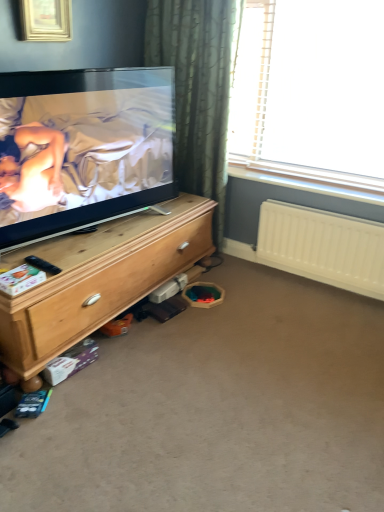
Question: From a real-world perspective, is white plastic radiator at lower right located beneath carpet at lower center?

Choices:
 (A) no
 (B) yes

Answer: (A)

Question: Can you confirm if white plastic radiator at lower right is positioned to the left of carpet at lower center?

Choices:
 (A) no
 (B) yes

Answer: (A)

Question: Is carpet at lower center a part of white plastic radiator at lower right?

Choices:
 (A) no
 (B) yes

Answer: (A)

Question: Is white plastic radiator at lower right not inside carpet at lower center?

Choices:
 (A) no
 (B) yes

Answer: (B)

Question: Is white plastic radiator at lower right wider than carpet at lower center?

Choices:
 (A) no
 (B) yes

Answer: (A)

Question: Visually, is carpet at lower center positioned to the left or to the right of gold metallic picture frame at upper left?

Choices:
 (A) right
 (B) left

Answer: (A)

Question: Considering the positions of point (269, 463) and point (36, 7), is point (269, 463) closer or farther from the camera than point (36, 7)?

Choices:
 (A) farther
 (B) closer

Answer: (B)

Question: From the image's perspective, is carpet at lower center located above or below gold metallic picture frame at upper left?

Choices:
 (A) below
 (B) above

Answer: (A)

Question: Relative to gold metallic picture frame at upper left, is carpet at lower center in front or behind?

Choices:
 (A) front
 (B) behind

Answer: (A)

Question: Considering the relative positions of wooden chest of drawers at left and transparent plastic window at upper right in the image provided, is wooden chest of drawers at left to the left or to the right of transparent plastic window at upper right?

Choices:
 (A) right
 (B) left

Answer: (B)

Question: From a real-world perspective, relative to transparent plastic window at upper right, is wooden chest of drawers at left vertically above or below?

Choices:
 (A) above
 (B) below

Answer: (B)

Question: Is wooden chest of drawers at left taller or shorter than transparent plastic window at upper right?

Choices:
 (A) short
 (B) tall

Answer: (A)

Question: Which is correct: wooden chest of drawers at left is inside transparent plastic window at upper right, or outside of it?

Choices:
 (A) outside
 (B) inside

Answer: (A)

Question: Is wooden chest of drawers at left spatially inside carpet at lower center, or outside of it?

Choices:
 (A) inside
 (B) outside

Answer: (B)

Question: From a real-world perspective, is wooden chest of drawers at left physically located above or below carpet at lower center?

Choices:
 (A) above
 (B) below

Answer: (A)